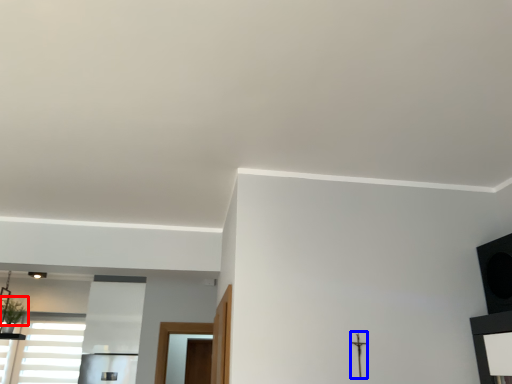
Question: Among these objects, which one is farthest to the camera, plant (highlighted by a red box) or crucifix (highlighted by a blue box)?

Choices:
 (A) plant
 (B) crucifix

Answer: (A)